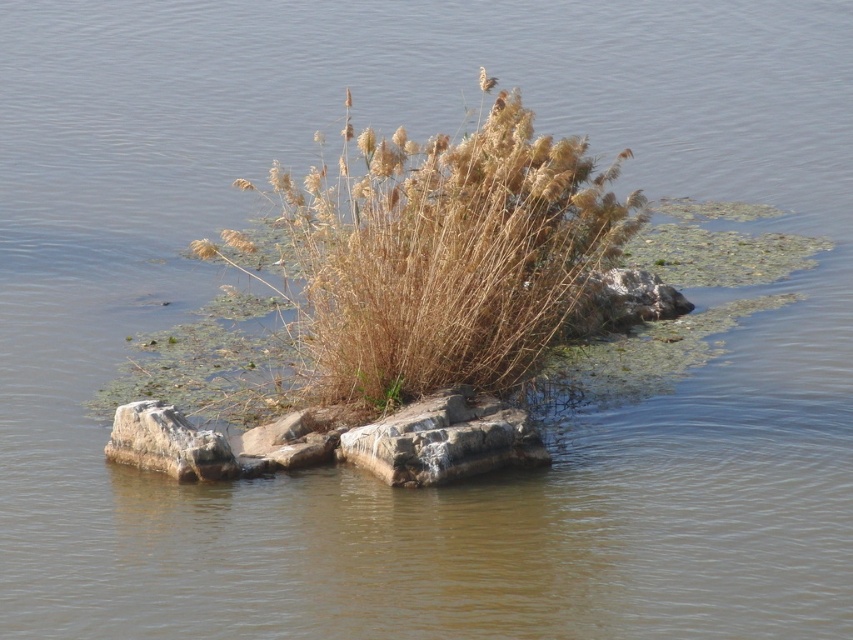
Is the position of gray/weathered stone at center more distant than that of gray/rocky stone at lower left?

No.

What do you see at coordinates (444, 440) in the screenshot? The image size is (853, 640). I see `gray/weathered stone at center` at bounding box center [444, 440].

Where is `gray/weathered stone at center`? gray/weathered stone at center is located at coordinates (444, 440).

Does dry grass at center have a greater height compared to gray/rocky stone at lower left?

Indeed, dry grass at center has a greater height compared to gray/rocky stone at lower left.

Does dry grass at center have a greater width compared to gray/rocky stone at lower left?

Indeed, dry grass at center has a greater width compared to gray/rocky stone at lower left.

Identify the location of dry grass at center. click(x=447, y=253).

Where is `dry grass at center`? This screenshot has height=640, width=853. dry grass at center is located at coordinates (447, 253).

Which is in front, point (351, 449) or point (582, 296)?

Point (351, 449)

Which is above, gray/weathered stone at center or gray rock at center?

gray rock at center

Is point (465, 419) farther from viewer compared to point (560, 336)?

No, it is in front of (560, 336).

The image size is (853, 640). I want to click on gray/weathered stone at center, so click(444, 440).